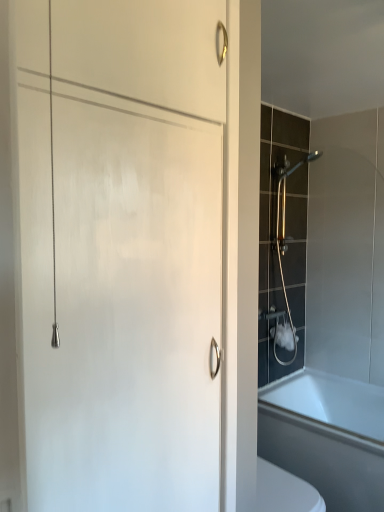
Find the location of a particular element. The image size is (384, 512). gold metallic shower at right is located at coordinates (286, 248).

The image size is (384, 512). What do you see at coordinates (286, 248) in the screenshot? I see `gold metallic shower at right` at bounding box center [286, 248].

What do you see at coordinates (327, 436) in the screenshot? The image size is (384, 512). I see `white glossy bathtub at lower right` at bounding box center [327, 436].

In order to click on white glossy bathtub at lower right in this screenshot , I will do `click(327, 436)`.

The height and width of the screenshot is (512, 384). Identify the location of gold metallic shower at right. (286, 248).

From the picture: Considering the relative positions of white glossy bathtub at lower right and gold metallic shower at right in the image provided, is white glossy bathtub at lower right to the left of gold metallic shower at right from the viewer's perspective?

Incorrect, white glossy bathtub at lower right is not on the left side of gold metallic shower at right.

Is white glossy bathtub at lower right in front of gold metallic shower at right?

Yes, the depth of white glossy bathtub at lower right is less than that of gold metallic shower at right.

Considering the positions of point (306, 436) and point (278, 260), is point (306, 436) closer or farther from the camera than point (278, 260)?

Point (306, 436) is closer to the camera than point (278, 260).

From the image's perspective, which object appears higher, white glossy bathtub at lower right or gold metallic shower at right?

gold metallic shower at right appears higher in the image.

From a real-world perspective, who is located higher, white glossy bathtub at lower right or gold metallic shower at right?

gold metallic shower at right, from a real-world perspective.

Looking at their sizes, would you say white glossy bathtub at lower right is wider or thinner than gold metallic shower at right?

In the image, white glossy bathtub at lower right appears to be wider than gold metallic shower at right.

Who is shorter, white glossy bathtub at lower right or gold metallic shower at right?

With less height is white glossy bathtub at lower right.

Is white glossy bathtub at lower right smaller than gold metallic shower at right?

No.

Would you say white glossy bathtub at lower right is outside gold metallic shower at right?

Yes.

Is white glossy bathtub at lower right next to gold metallic shower at right and touching it?

No, white glossy bathtub at lower right is not making contact with gold metallic shower at right.

Does white glossy bathtub at lower right turn towards gold metallic shower at right?

No.

This screenshot has width=384, height=512. I want to click on bathtub lying on the right of gold metallic shower at right, so point(327,436).

Considering the positions of objects gold metallic shower at right and white glossy bathtub at lower right in the image provided, who is more to the left, gold metallic shower at right or white glossy bathtub at lower right?

From the viewer's perspective, gold metallic shower at right appears more on the left side.

Is the depth of gold metallic shower at right greater than that of white glossy bathtub at lower right?

Yes.

Does point (319, 156) lie in front of point (263, 432)?

No, it is behind (263, 432).

From the image's perspective, which object appears higher, gold metallic shower at right or white glossy bathtub at lower right?

gold metallic shower at right.

From a real-world perspective, is gold metallic shower at right located higher than white glossy bathtub at lower right?

Correct, in the physical world, gold metallic shower at right is higher than white glossy bathtub at lower right.

Does gold metallic shower at right have a lesser width compared to white glossy bathtub at lower right?

Indeed, gold metallic shower at right has a lesser width compared to white glossy bathtub at lower right.

Between gold metallic shower at right and white glossy bathtub at lower right, which one has more height?

gold metallic shower at right.

Does gold metallic shower at right have a larger size compared to white glossy bathtub at lower right?

No.

Is white glossy bathtub at lower right completely or partially inside gold metallic shower at right?

Definitely not — white glossy bathtub at lower right is not inside gold metallic shower at right.

Is gold metallic shower at right not near white glossy bathtub at lower right?

No.

Is gold metallic shower at right facing towards white glossy bathtub at lower right?

No, gold metallic shower at right is not oriented towards white glossy bathtub at lower right.

Can you tell me how much gold metallic shower at right and white glossy bathtub at lower right differ in facing direction?

They differ by 91.2 degrees in their facing directions.

In order to click on bathtub on the right of the gold metallic shower at right in this screenshot , I will do `click(327, 436)`.

The height and width of the screenshot is (512, 384). I want to click on bathtub below the gold metallic shower at right (from a real-world perspective), so click(327, 436).

Where is `bathtub that appears on the right of gold metallic shower at right`? Image resolution: width=384 pixels, height=512 pixels. bathtub that appears on the right of gold metallic shower at right is located at coordinates (327, 436).